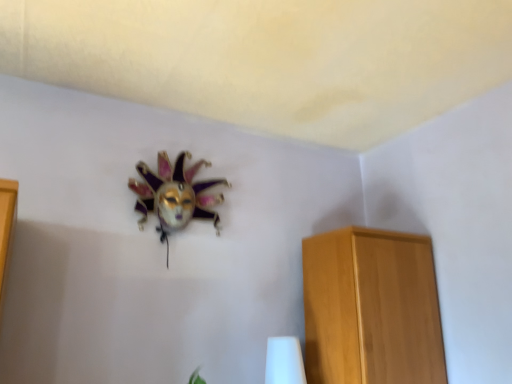
Question: Is white glossy table lamp at lower center wider than light brown wooden cabinet at right?

Choices:
 (A) yes
 (B) no

Answer: (B)

Question: Is white glossy table lamp at lower center positioned far away from light brown wooden cabinet at right?

Choices:
 (A) yes
 (B) no

Answer: (B)

Question: From a real-world perspective, is white glossy table lamp at lower center under light brown wooden cabinet at right?

Choices:
 (A) yes
 (B) no

Answer: (A)

Question: Is white glossy table lamp at lower center positioned beyond the bounds of light brown wooden cabinet at right?

Choices:
 (A) no
 (B) yes

Answer: (B)

Question: Does white glossy table lamp at lower center have a smaller size compared to light brown wooden cabinet at right?

Choices:
 (A) no
 (B) yes

Answer: (B)

Question: From the image's perspective, is white glossy table lamp at lower center located above or below light brown wooden cabinet at right?

Choices:
 (A) above
 (B) below

Answer: (B)

Question: Is white glossy table lamp at lower center wider or thinner than light brown wooden cabinet at right?

Choices:
 (A) wide
 (B) thin

Answer: (B)

Question: Is white glossy table lamp at lower center taller or shorter than light brown wooden cabinet at right?

Choices:
 (A) short
 (B) tall

Answer: (A)

Question: Is white glossy table lamp at lower center spatially inside light brown wooden cabinet at right, or outside of it?

Choices:
 (A) outside
 (B) inside

Answer: (A)

Question: From their relative heights in the image, would you say light brown wooden cabinet at right is taller or shorter than metallic mask at upper center?

Choices:
 (A) short
 (B) tall

Answer: (B)

Question: Relative to metallic mask at upper center, is light brown wooden cabinet at right in front or behind?

Choices:
 (A) front
 (B) behind

Answer: (A)

Question: Considering the positions of point (386, 314) and point (164, 213), is point (386, 314) closer or farther from the camera than point (164, 213)?

Choices:
 (A) closer
 (B) farther

Answer: (A)

Question: In terms of size, does light brown wooden cabinet at right appear bigger or smaller than metallic mask at upper center?

Choices:
 (A) big
 (B) small

Answer: (A)

Question: Looking at the image, does metallic mask at upper center seem bigger or smaller compared to light brown wooden cabinet at right?

Choices:
 (A) small
 (B) big

Answer: (A)

Question: Considering the positions of point (159, 221) and point (313, 264), is point (159, 221) closer or farther from the camera than point (313, 264)?

Choices:
 (A) closer
 (B) farther

Answer: (A)